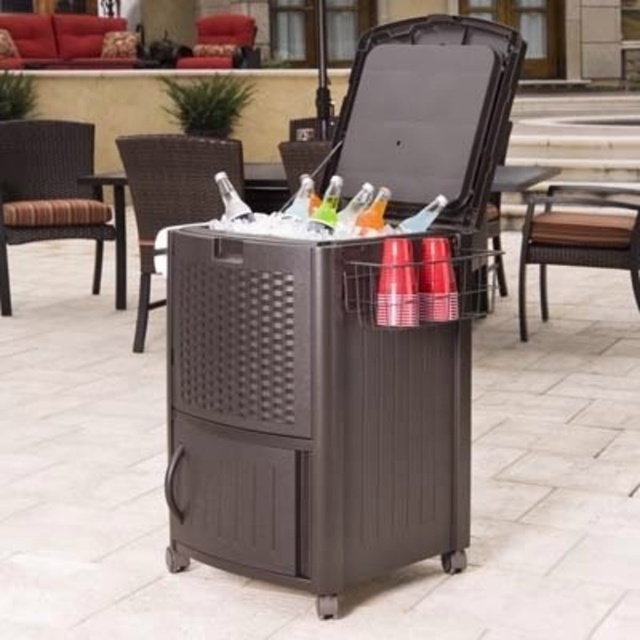
You are organizing a small outdoor gathering and need to place a 1.5 meter long table between the brown wicker chair at right and the matte plastic chair at upper center. Is there enough space to fit the table between them?

The distance between the brown wicker chair at right and the matte plastic chair at upper center is 1.48 meters. Since the table is 1.5 meters long, it would not fit between them as the space is slightly shorter than the table.

You are setting up a picnic area and need to place a large blanket between the brown wicker chair at left and the brown plastic table at center. Based on their positions, where should you place the blanket to ensure it is between both items?

The brown wicker chair at left is below the brown plastic table at center, so placing the blanket between them would require positioning it above the chair and below the table to ensure it is between both items.

In the scene shown: You are planning to sit down on the brown wicker chair at left or the brown plastic cooler at center. Which one is taller?

The brown wicker chair at left is taller than the brown plastic cooler at center.